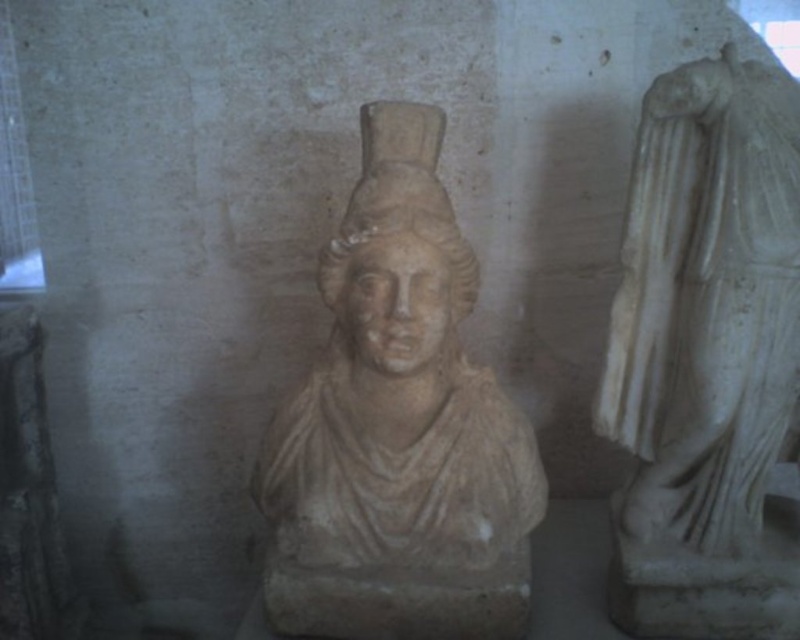
In the scene shown: You are an art conservator tasked with moving the white marble statue at right closer to the white stone bust at center. The minimum safe distance between them should be 25 centimeters to prevent accidental collision. Is the current distance sufficient?

The white marble statue at right is currently 30.25 centimeters away from the white stone bust at center, which is more than the required 25 centimeters. Therefore, the current distance is sufficient to prevent accidental collisions while maintaining the minimum safe separation.

You are an art conservator tasked with moving both the beige stone bust at center and the white marble statue at right to a new exhibition hall. The transport crate you have can only accommodate items that take up a certain amount of space. Based on the scene, which object will require a larger crate?

The white marble statue at right requires a larger crate because it occupies more space than the beige stone bust at center.